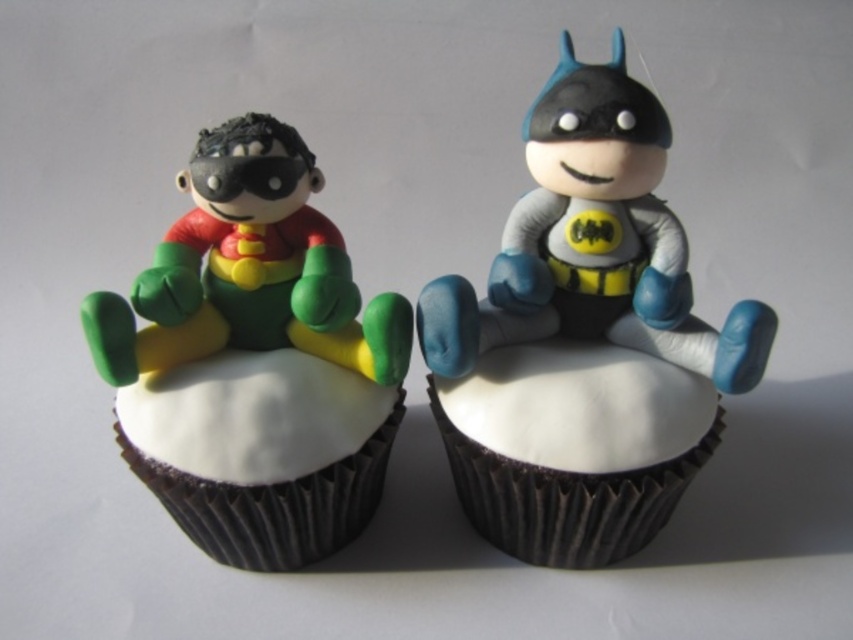
Looking at this image, what object is located at the coordinate point (257,355) in the image?

The point (257,355) indicates the location of the matte green plastic toy at left.

You are a photographer taking a picture of the two cupcakes. You notice two specific points on the cupcakes, labeled as point 1 at coordinates point (573,243) and point 2 at coordinates point (345,534). Which point is closer to the camera?

Point 1 at coordinates point (573,243) is closer to the camera because it is in front of point 2 at coordinates point (345,534).